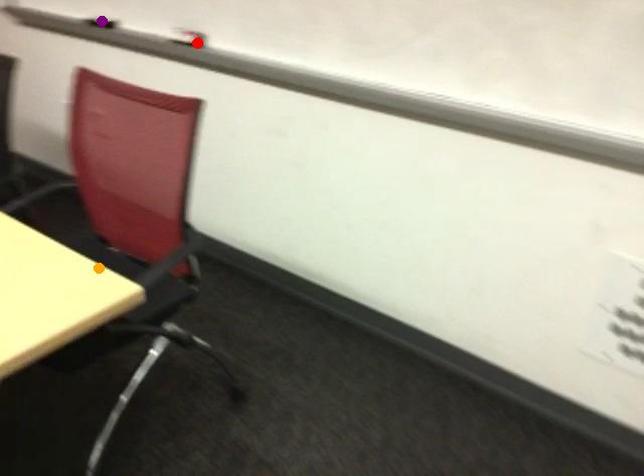
Order these from nearest to farthest:
purple point, orange point, red point

orange point, red point, purple point